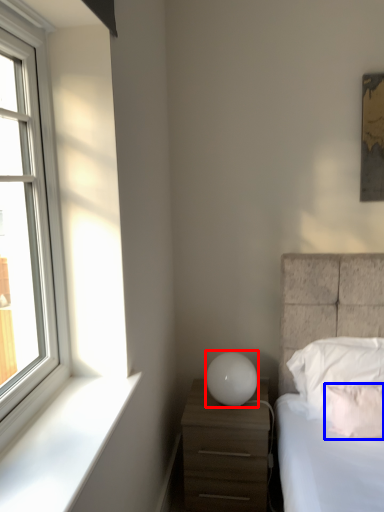
Question: Which of the following is the farthest to the observer, table lamp (highlighted by a red box) or pillow (highlighted by a blue box)?

Choices:
 (A) table lamp
 (B) pillow

Answer: (A)